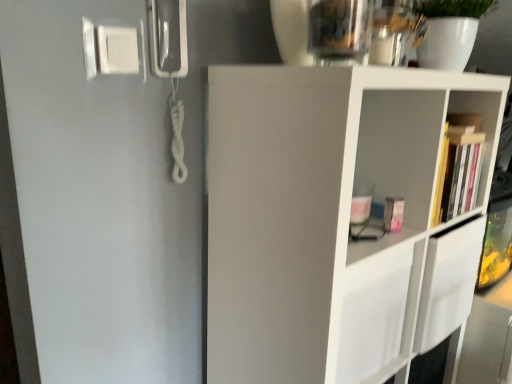
Question: Is white matte shelf at center to the right of hardcover book at right from the viewer's perspective?

Choices:
 (A) yes
 (B) no

Answer: (B)

Question: Is white matte shelf at center facing towards hardcover book at right?

Choices:
 (A) yes
 (B) no

Answer: (A)

Question: Would you say white matte shelf at center is a long distance from hardcover book at right?

Choices:
 (A) no
 (B) yes

Answer: (A)

Question: Does white matte shelf at center have a greater width compared to hardcover book at right?

Choices:
 (A) no
 (B) yes

Answer: (B)

Question: Is white matte shelf at center positioned behind hardcover book at right?

Choices:
 (A) no
 (B) yes

Answer: (A)

Question: From their relative heights in the image, would you say white matte shelf at center is taller or shorter than transparent glass vase at upper center?

Choices:
 (A) short
 (B) tall

Answer: (B)

Question: Is white matte shelf at center in front of or behind transparent glass vase at upper center in the image?

Choices:
 (A) front
 (B) behind

Answer: (A)

Question: Which is correct: white matte shelf at center is inside transparent glass vase at upper center, or outside of it?

Choices:
 (A) outside
 (B) inside

Answer: (A)

Question: Looking at their shapes, would you say white matte shelf at center is wider or thinner than transparent glass vase at upper center?

Choices:
 (A) wide
 (B) thin

Answer: (A)

Question: Visually, is white matte shelf at center positioned to the left or to the right of hardcover book at right?

Choices:
 (A) left
 (B) right

Answer: (A)

Question: Considering the positions of white matte shelf at center and hardcover book at right in the image, is white matte shelf at center wider or thinner than hardcover book at right?

Choices:
 (A) thin
 (B) wide

Answer: (B)

Question: From a real-world perspective, is white matte shelf at center physically located above or below hardcover book at right?

Choices:
 (A) above
 (B) below

Answer: (B)

Question: Choose the correct answer: Is white matte shelf at center inside hardcover book at right or outside it?

Choices:
 (A) inside
 (B) outside

Answer: (B)

Question: Would you say transparent glass vase at upper center is inside or outside hardcover book at right?

Choices:
 (A) inside
 (B) outside

Answer: (B)

Question: Visually, is transparent glass vase at upper center positioned to the left or to the right of hardcover book at right?

Choices:
 (A) right
 (B) left

Answer: (B)